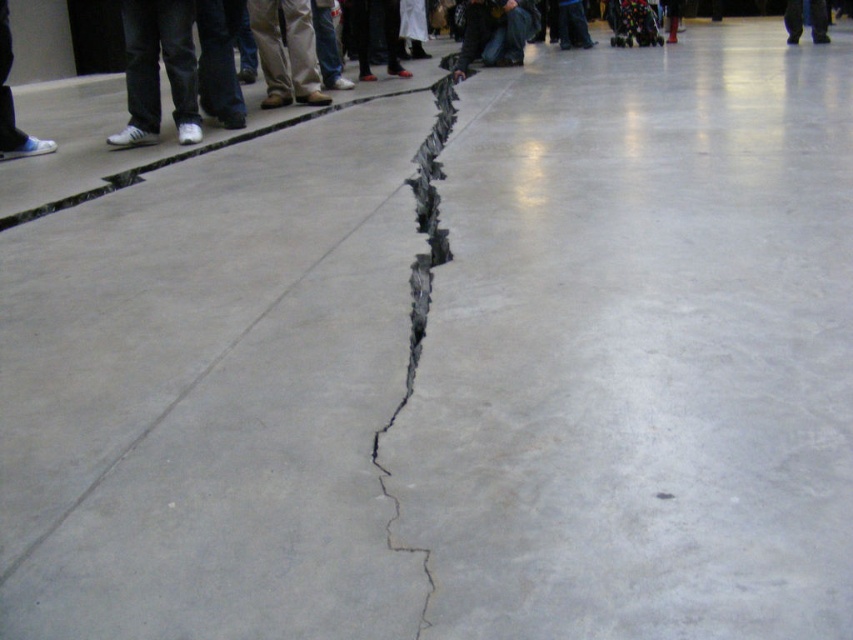
You are standing at the center of the concrete floor and see the white leather shoes at left and the black leather pants at right. Which object is closer to your left side?

The white leather shoes at left are closer to your left side since they are positioned to the left of the black leather pants at right.

From the picture: You are a photographer trying to capture the crack in the floor. You notice the white leather shoes at left and the brown leather pants at center in your shot. Which object should you adjust your focus to ensure the taller one is in sharp focus?

The white leather shoes at left is taller than the brown leather pants at center, so you should adjust your focus to the white leather shoes at left to ensure it is in sharp focus.